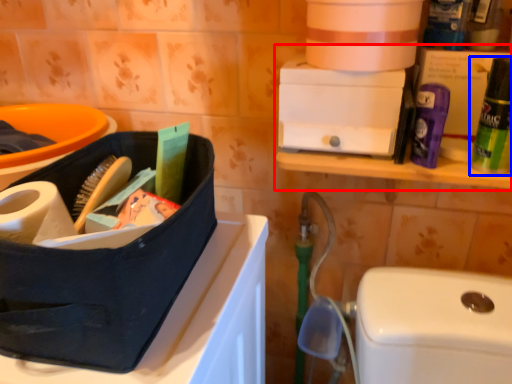
Question: Which object is closer to the camera taking this photo, shelf (highlighted by a red box) or cleaning product (highlighted by a blue box)?

Choices:
 (A) shelf
 (B) cleaning product

Answer: (B)